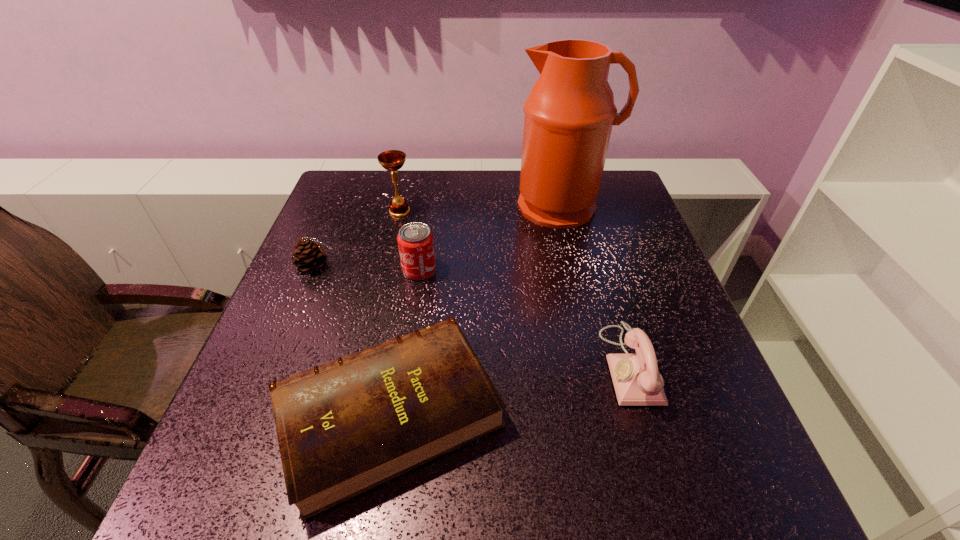
Where is `the tallest object`? This screenshot has height=540, width=960. the tallest object is located at coordinates (569, 114).

You are a GUI agent. You are given a task and a screenshot of the screen. Output one action in this format:
    pyautogui.click(x=<x>, y=<y>)
    Task: Click on the chalice
    This screenshot has height=540, width=960.
    Given the screenshot: What is the action you would take?
    pyautogui.click(x=392, y=160)

Where is `can`? can is located at coordinates (x=415, y=240).

I want to click on telephone, so click(x=636, y=378).

Where is `the second shortest object`? The height and width of the screenshot is (540, 960). the second shortest object is located at coordinates (309, 255).

At what (x,y) coordinates should I click in order to perform the action: click on the shortest object. Please return your answer as a coordinate pair (x, y). The image size is (960, 540). Looking at the image, I should click on [344, 427].

Identify the location of vacant space positioned 0.170m from the spout of the water jug. (579, 273).

You are a GUI agent. You are given a task and a screenshot of the screen. Output one action in this format:
    pyautogui.click(x=<x>, y=<y>)
    Task: Click on the vacant space located on the back of the chalice
    Image resolution: width=960 pixels, height=540 pixels.
    Given the screenshot: What is the action you would take?
    pyautogui.click(x=403, y=194)

Find the location of `vacant space situated 0.300m on the right of the can`. vacant space situated 0.300m on the right of the can is located at coordinates (561, 270).

I want to click on free region located 0.160m on the dial of the telephone, so click(524, 365).